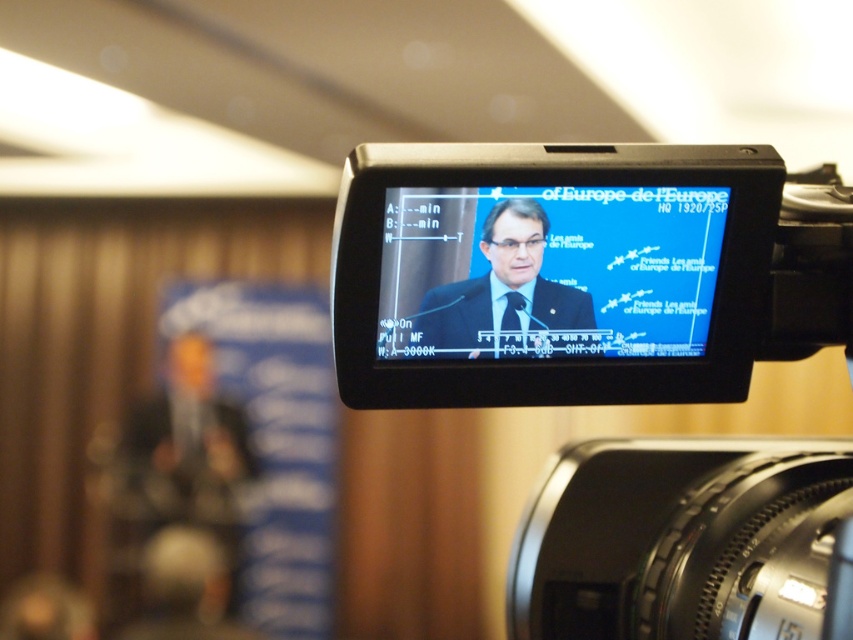
Question: Observing the image, what is the correct spatial positioning of black plastic video camera at center in reference to matte black monitor at center?

Choices:
 (A) below
 (B) above

Answer: (A)

Question: Is black plastic video camera at center thinner than matte black monitor at center?

Choices:
 (A) no
 (B) yes

Answer: (A)

Question: Is black plastic video camera at center positioned before matte black screen at center?

Choices:
 (A) no
 (B) yes

Answer: (B)

Question: Among these objects, which one is farthest from the camera?

Choices:
 (A) matte black screen at center
 (B) black plastic video camera at center

Answer: (A)

Question: Which object is the closest to the matte black monitor at center?

Choices:
 (A) black plastic video camera at center
 (B) matte black screen at center

Answer: (B)

Question: Which of the following is the closest to the observer?

Choices:
 (A) (482, 237)
 (B) (717, 467)
 (C) (613, 310)

Answer: (A)